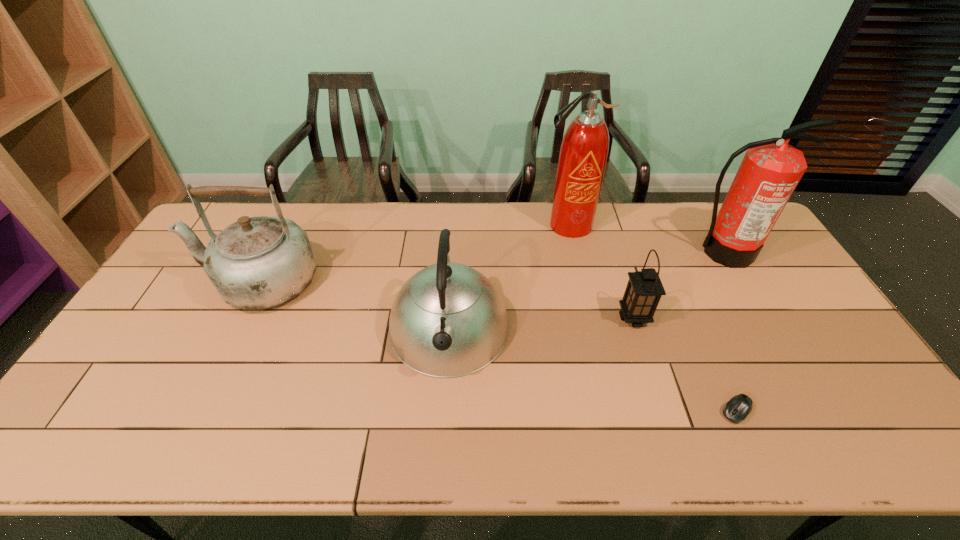
The image size is (960, 540). In the image, there is a desktop. What are the coordinates of `vacant space at the far edge` in the screenshot? It's located at (265, 211).

In the image, there is a desktop. In order to click on vacant space at the near edge in this screenshot , I will do `click(430, 440)`.

What are the coordinates of `vacant region at the left edge of the desktop` in the screenshot? It's located at (132, 332).

Locate an element on the screen. vacant space at the right edge is located at coordinates (766, 246).

What are the coordinates of `vacant area at the far left corner of the desktop` in the screenshot? It's located at (218, 220).

This screenshot has height=540, width=960. Find the location of `free area in between the second object from right to left and the fifth tallest object`. free area in between the second object from right to left and the fifth tallest object is located at coordinates (684, 364).

Image resolution: width=960 pixels, height=540 pixels. I want to click on empty space between the rightmost object and the lantern, so click(679, 285).

The width and height of the screenshot is (960, 540). What are the coordinates of `vacant space in between the left fire extinguisher and the second shortest object` in the screenshot? It's located at pos(601,272).

I want to click on unoccupied area between the left fire extinguisher and the taller kettle, so click(414, 253).

The image size is (960, 540). I want to click on free spot between the nearest object and the fourth tallest object, so click(x=592, y=370).